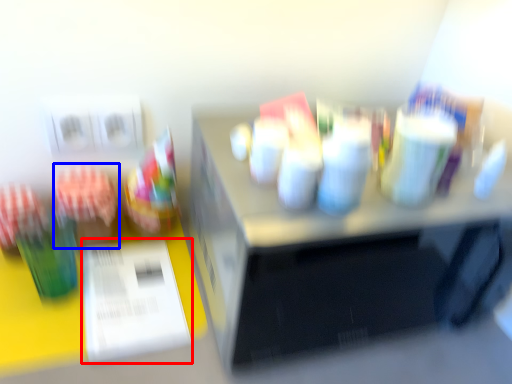
Question: Among these objects, which one is nearest to the camera, paper (highlighted by a red box) or stationery (highlighted by a blue box)?

Choices:
 (A) paper
 (B) stationery

Answer: (A)